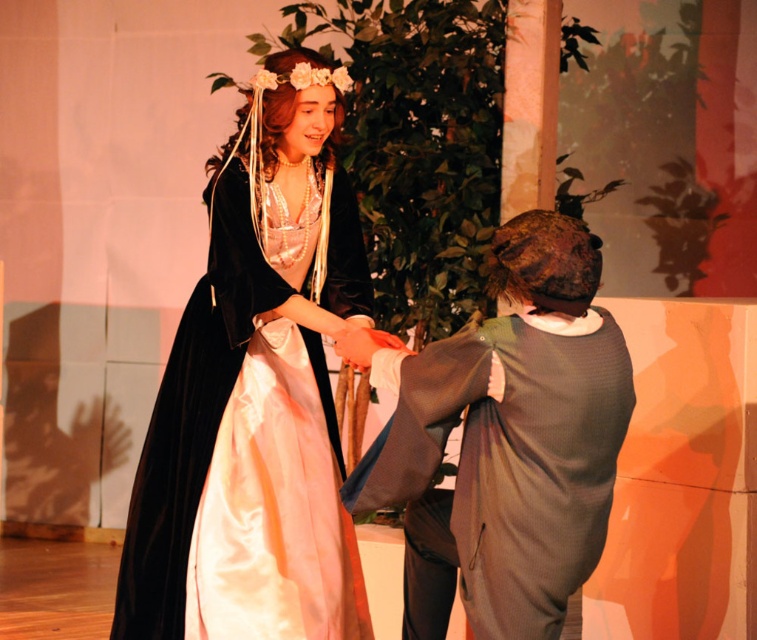
Can you confirm if velvet black dress at center is positioned above dark gray wool coat at center?

Yes.

Is velvet black dress at center wider than dark gray wool coat at center?

Indeed, velvet black dress at center has a greater width compared to dark gray wool coat at center.

Between point (181, 465) and point (555, 493), which one is positioned behind?

Positioned behind is point (181, 465).

Find the location of a particular element. Image resolution: width=757 pixels, height=640 pixels. velvet black dress at center is located at coordinates (256, 392).